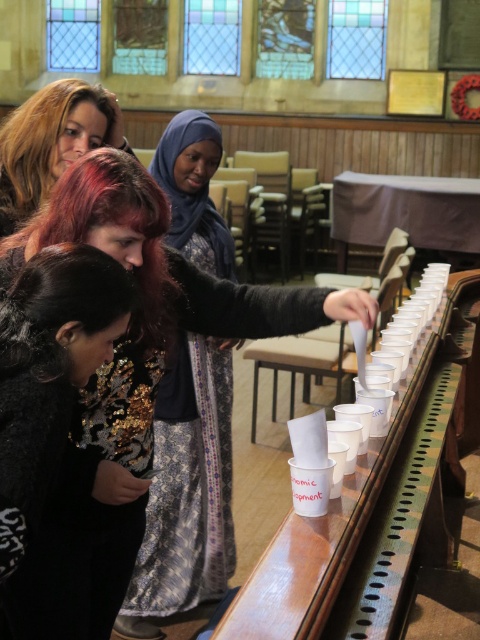
Which is below, patterned fabric dress at center or matte black hair at upper left?

patterned fabric dress at center is lower down.

Does patterned fabric dress at center have a greater height compared to matte black hair at upper left?

Yes.

This screenshot has height=640, width=480. I want to click on patterned fabric dress at center, so click(x=187, y=490).

Does patterned fabric dress at center lie behind black sequined dress at lower left?

Yes.

Is point (194, 493) closer to viewer compared to point (22, 442)?

No, it is behind (22, 442).

Which is in front, point (216, 428) or point (16, 355)?

Point (16, 355)

Locate an element on the screen. patterned fabric dress at center is located at coordinates (187, 490).

Is sequined fabric dress at center smaller than matte black hair at upper left?

No, sequined fabric dress at center is not smaller than matte black hair at upper left.

This screenshot has width=480, height=640. Describe the element at coordinates (129, 387) in the screenshot. I see `sequined fabric dress at center` at that location.

The height and width of the screenshot is (640, 480). In order to click on sequined fabric dress at center in this screenshot , I will do `click(129, 387)`.